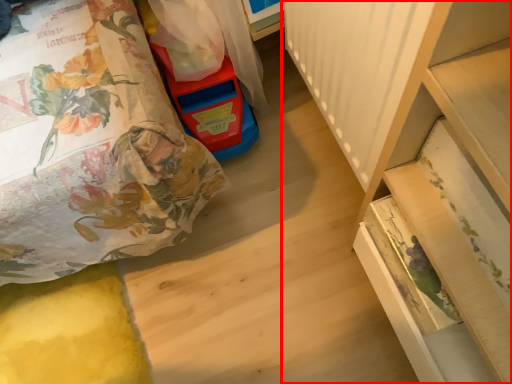
Question: From the image's perspective, what is the correct spatial positioning of furniture (annotated by the red box) in reference to toy?

Choices:
 (A) above
 (B) below

Answer: (B)